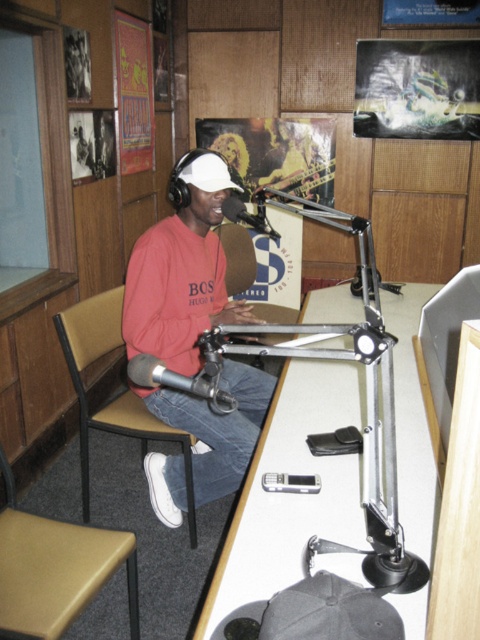
Question: Which object is the farthest from the black metallic microphone at center?

Choices:
 (A) brown fabric chair at left
 (B) white plastic table at center

Answer: (A)

Question: Is matte red sweatshirt at center behind black metallic microphone at center?

Choices:
 (A) no
 (B) yes

Answer: (B)

Question: Estimate the real-world distances between objects in this image. Which object is closer to the matte red sweatshirt at center?

Choices:
 (A) black metallic microphone at center
 (B) brown fabric chair at left
 (C) tan leather chair at lower left

Answer: (B)

Question: In this image, where is white plastic table at center located relative to black metallic microphone at center?

Choices:
 (A) above
 (B) below

Answer: (B)

Question: Which point is farther to the camera?

Choices:
 (A) silver metallic microphone at center
 (B) black metallic microphone at center
 (C) tan leather chair at lower left
 (D) white plastic table at center

Answer: (A)

Question: Is matte red sweatshirt at center above brown fabric chair at left?

Choices:
 (A) no
 (B) yes

Answer: (B)